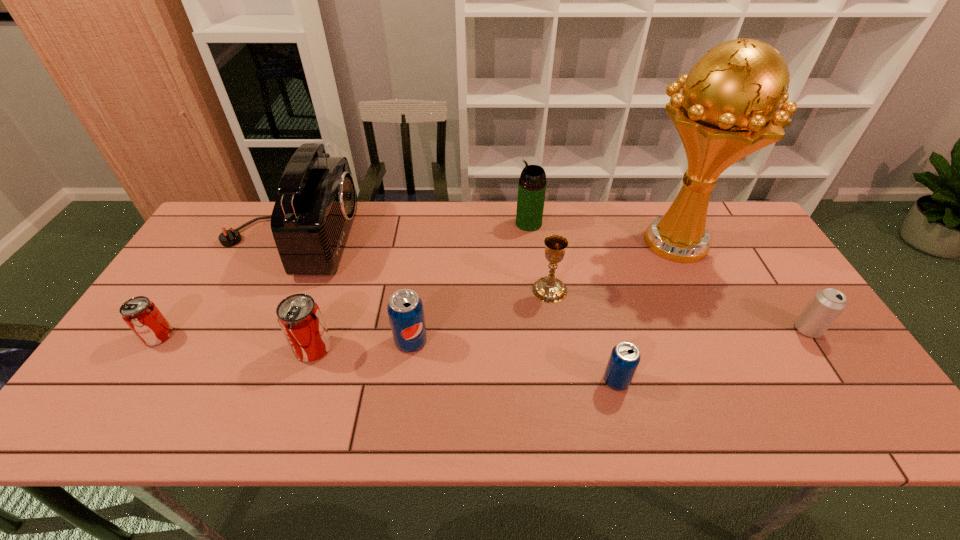
Where is `vacant area in the image that satisfies the following two spatial constraints: 1. on the front-facing side of the bigger red pop soda; 2. on the right side of the radio receiver`? Image resolution: width=960 pixels, height=540 pixels. vacant area in the image that satisfies the following two spatial constraints: 1. on the front-facing side of the bigger red pop soda; 2. on the right side of the radio receiver is located at coordinates (236, 348).

Where is `free location that satisfies the following two spatial constraints: 1. at the front of the tallest object where the globe is prominent; 2. on the front side of the bigger red pop soda`? Image resolution: width=960 pixels, height=540 pixels. free location that satisfies the following two spatial constraints: 1. at the front of the tallest object where the globe is prominent; 2. on the front side of the bigger red pop soda is located at coordinates (723, 348).